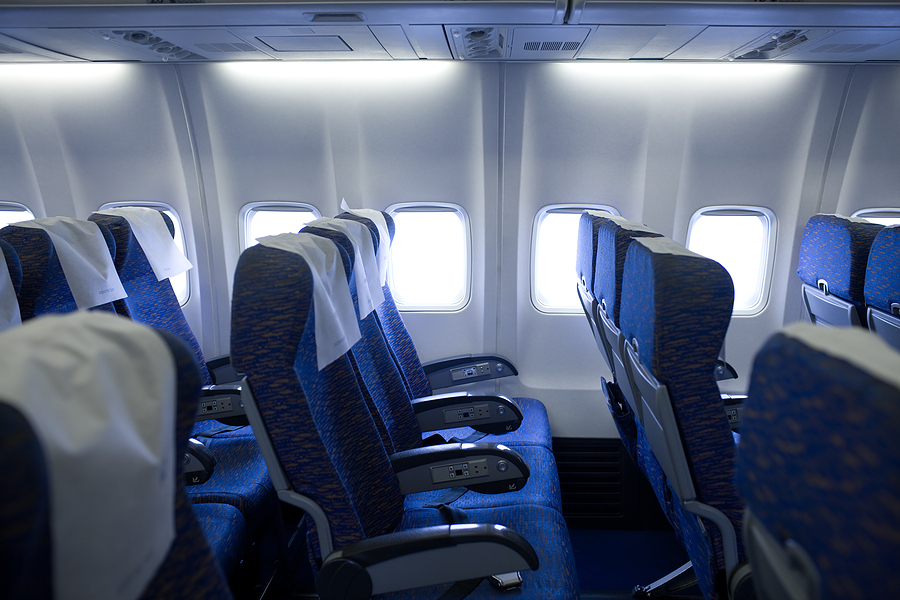
Identify the location of chair handles on the right. (742, 407), (724, 378), (489, 526), (493, 457), (498, 403), (493, 356).